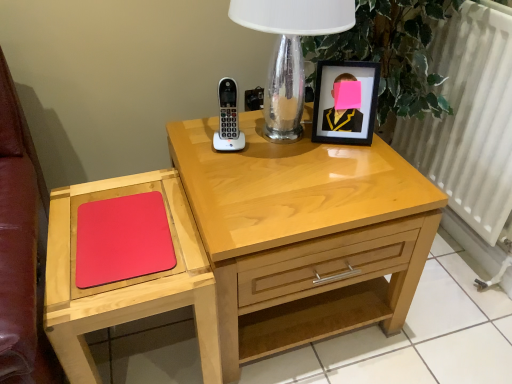
Locate an element on the screen. vacant space in front of clear glass table lamp at upper center is located at coordinates (294, 190).